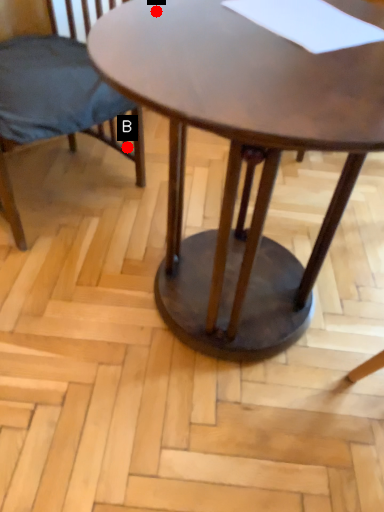
Question: Two points are circled on the image, labeled by A and B beside each circle. Among these points, which one is farthest from the camera?

Choices:
 (A) A is further
 (B) B is further

Answer: (B)